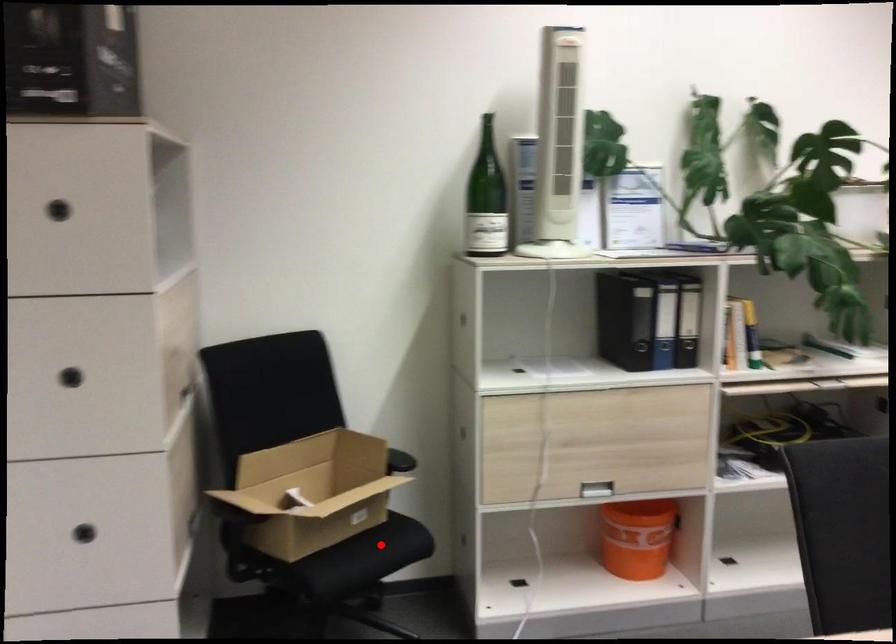
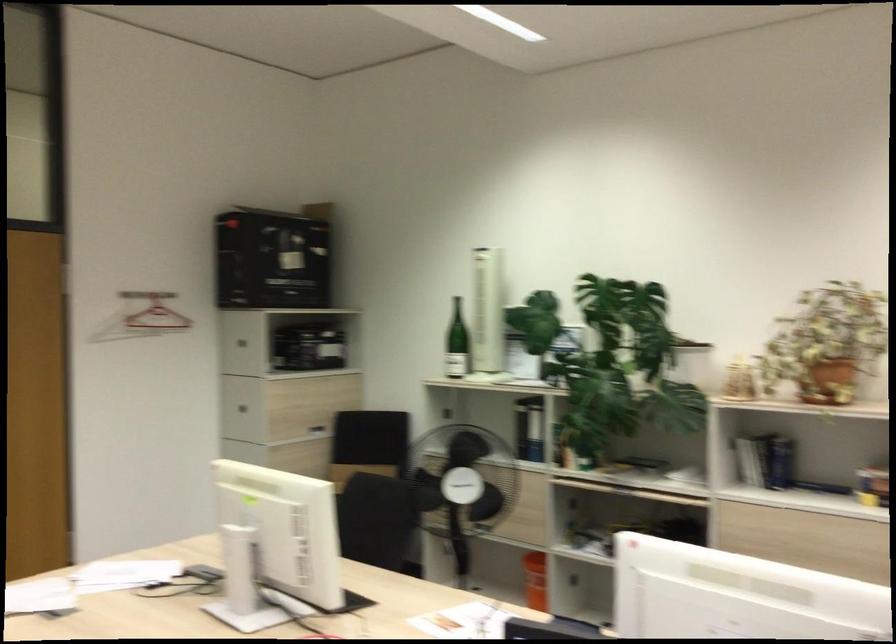
Question: I am providing you with two images of the same scene from different viewpoints. A red point is marked on the first image. At the location where the point appears in image 1, is it still visible in image 2?

Choices:
 (A) Yes
 (B) No

Answer: (B)